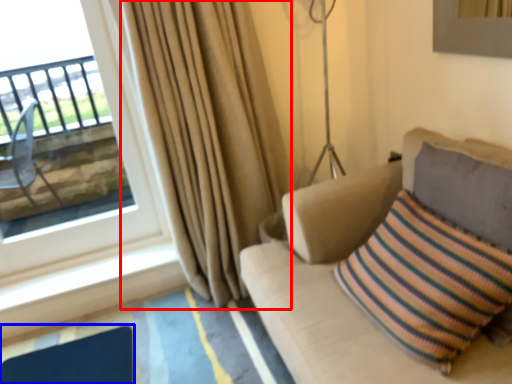
Question: Which point is closer to the camera, curtain (highlighted by a red box) or flat (highlighted by a blue box)?

Choices:
 (A) curtain
 (B) flat

Answer: (A)